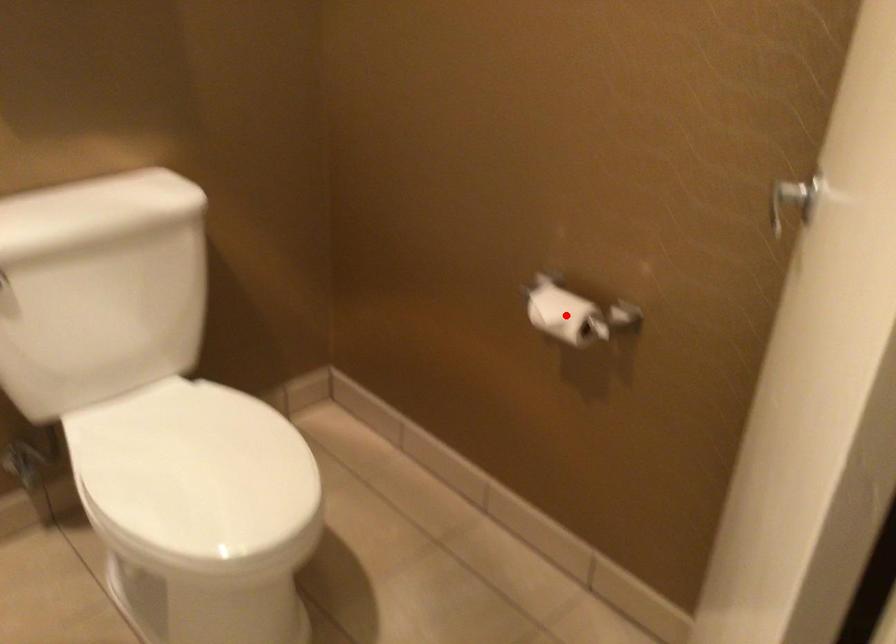
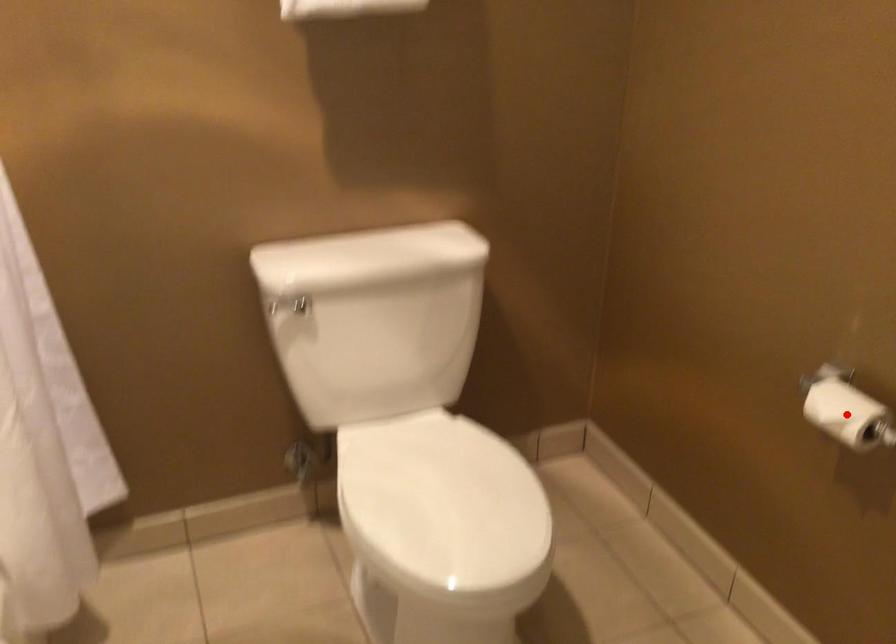
I am providing you with two images of the same scene from different viewpoints. A red point is marked on the first image and another point is marked on the second image. Do the highlighted points in image1 and image2 indicate the same real-world spot?

Yes